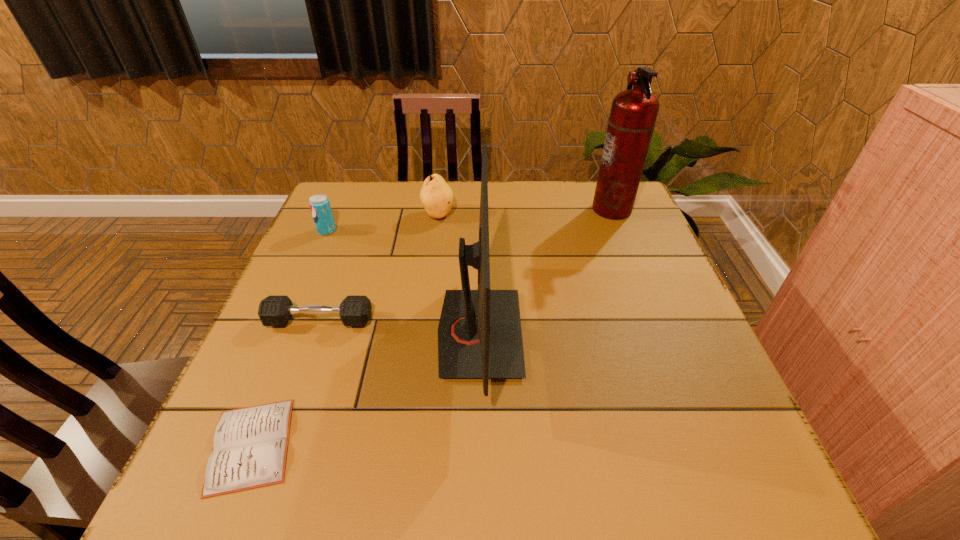
This screenshot has width=960, height=540. In order to click on blank space that satisfies the following two spatial constraints: 1. on the nozzle side of the rightmost object; 2. on the front side of the shortest object in this screenshot , I will do `click(706, 445)`.

What are the coordinates of `vacant space that satisfies the following two spatial constraints: 1. on the screen side of the monitor; 2. on the front side of the shortest object` in the screenshot? It's located at (479, 445).